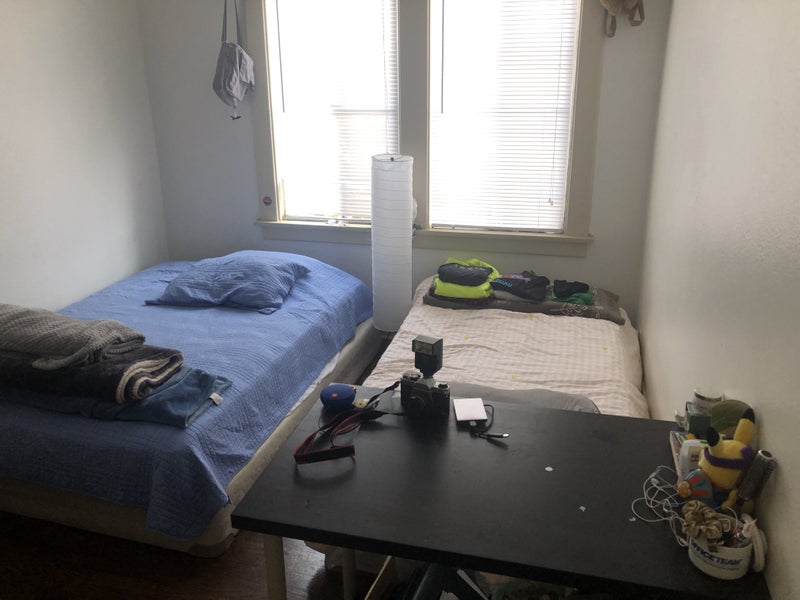
You are a GUI agent. You are given a task and a screenshot of the screen. Output one action in this format:
    pyautogui.click(x=<x>, y=<y>)
    Task: Click on the bed
    The image size is (800, 600).
    Given the screenshot: What is the action you would take?
    pyautogui.click(x=537, y=344), pyautogui.click(x=258, y=368)